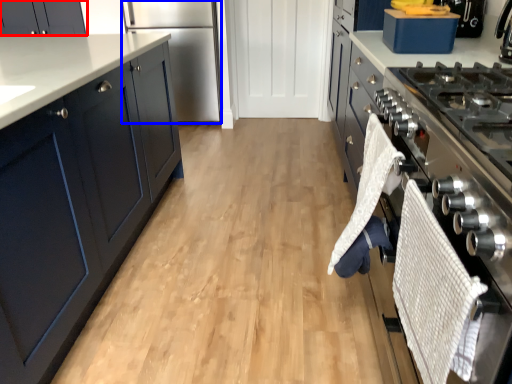
Question: Which object appears farthest to the camera in this image, cabinetry (highlighted by a red box) or refrigerator (highlighted by a blue box)?

Choices:
 (A) cabinetry
 (B) refrigerator

Answer: (A)